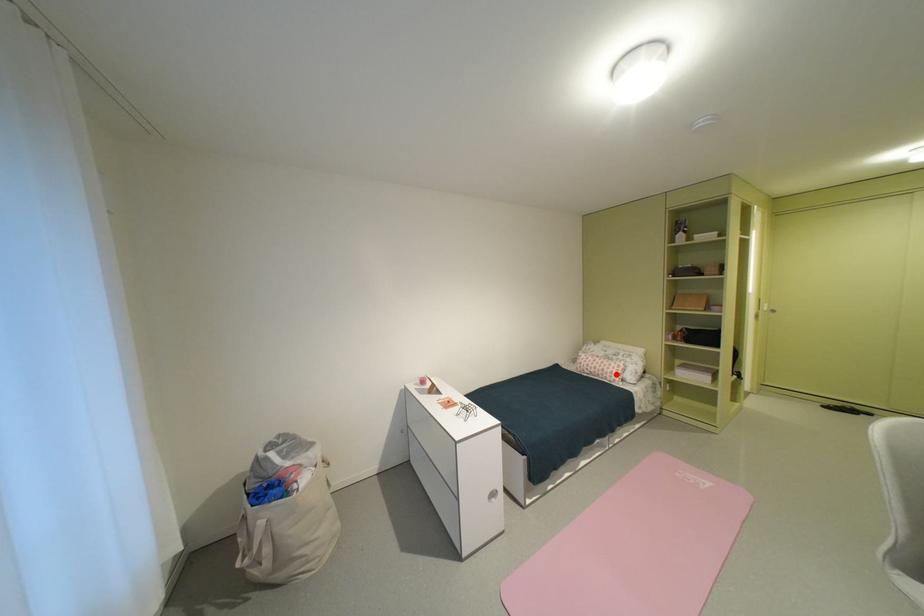
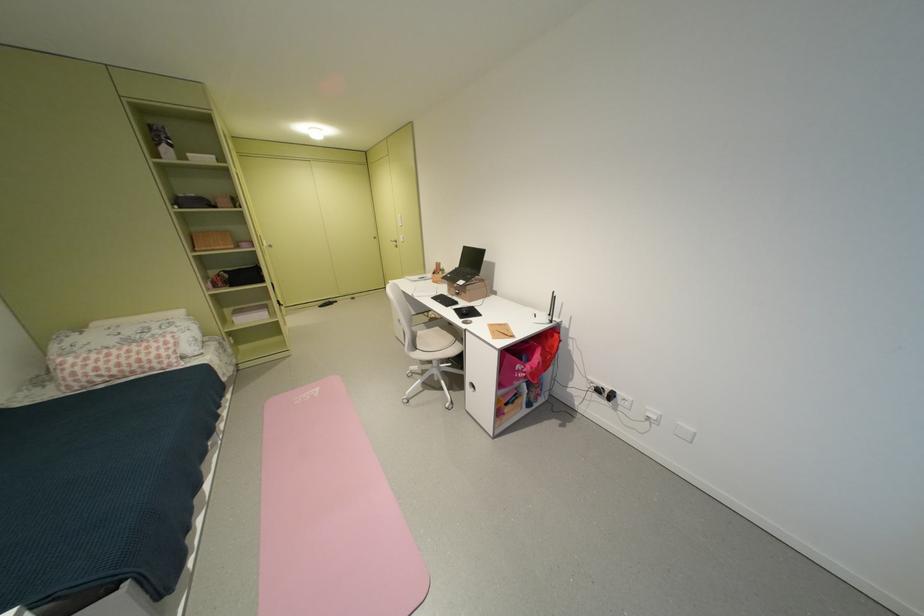
Question: A red point is marked in image1. In image2, is the corresponding 3D point closer to the camera or farther? Reply with the corresponding letter.

Choices:
 (A) The corresponding 3D point is closer.
 (B) The corresponding 3D point is farther.

Answer: (A)